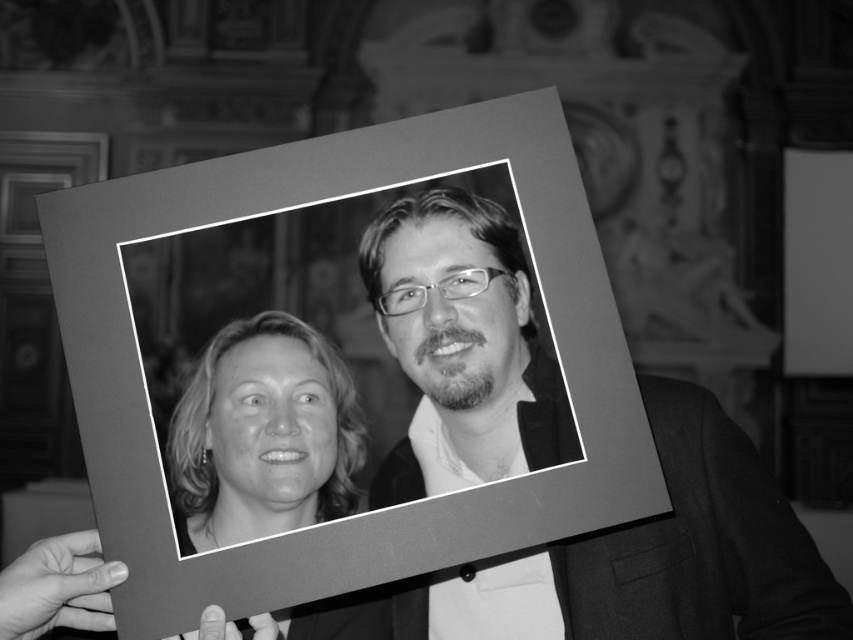
Is matte gray picture frame at center wider than smooth blonde hair at center?

Correct, the width of matte gray picture frame at center exceeds that of smooth blonde hair at center.

Who is positioned more to the right, matte gray picture frame at center or smooth blonde hair at center?

matte gray picture frame at center

This screenshot has height=640, width=853. What do you see at coordinates (375, 509) in the screenshot?
I see `matte gray picture frame at center` at bounding box center [375, 509].

At what (x,y) coordinates should I click in order to perform the action: click on matte gray picture frame at center. Please return your answer as a coordinate pair (x, y). Looking at the image, I should click on (375, 509).